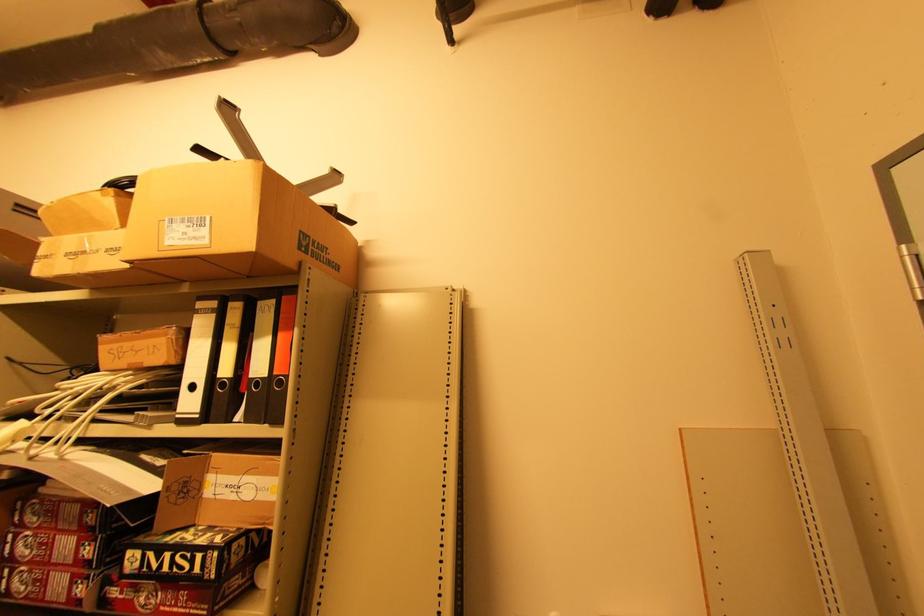
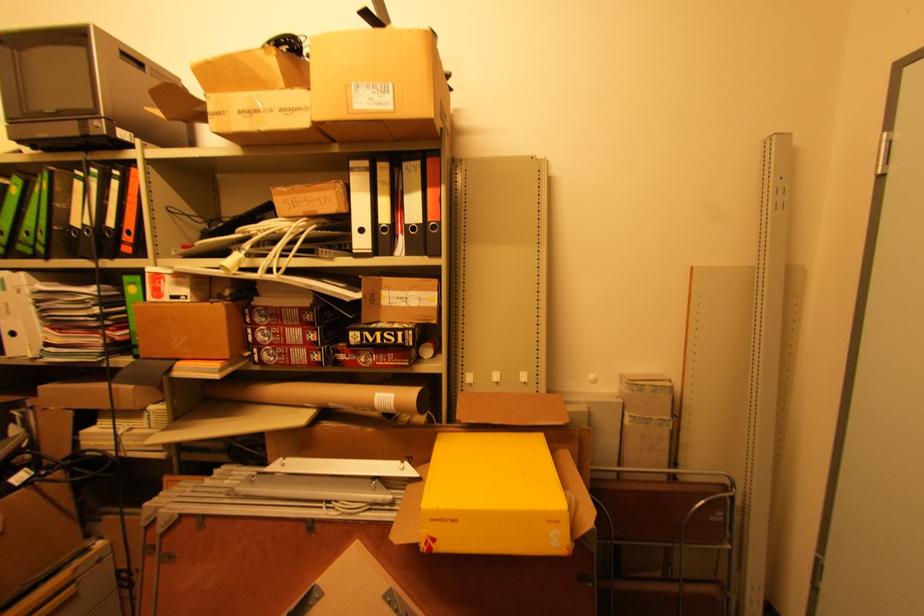
Question: The first image is from the beginning of the video and the second image is from the end. How did the camera likely rotate when shooting the video?

Choices:
 (A) Left
 (B) Right
 (C) Up
 (D) Down

Answer: (D)